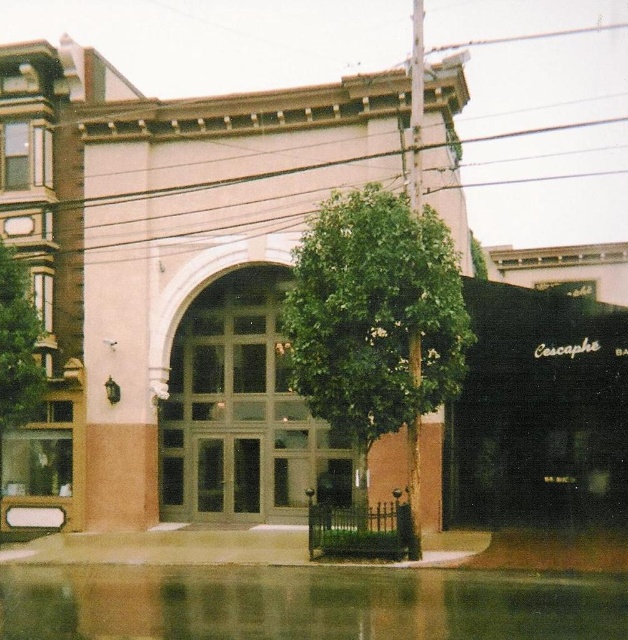
Who is positioned more to the right, green leafy tree at center or green leafy tree at left?

From the viewer's perspective, green leafy tree at center appears more on the right side.

Describe the element at coordinates (376, 321) in the screenshot. I see `green leafy tree at center` at that location.

Identify the location of green leafy tree at center. This screenshot has width=628, height=640. (376, 321).

Find the location of a particular element. This screenshot has width=628, height=640. green leafy tree at center is located at coordinates (376, 321).